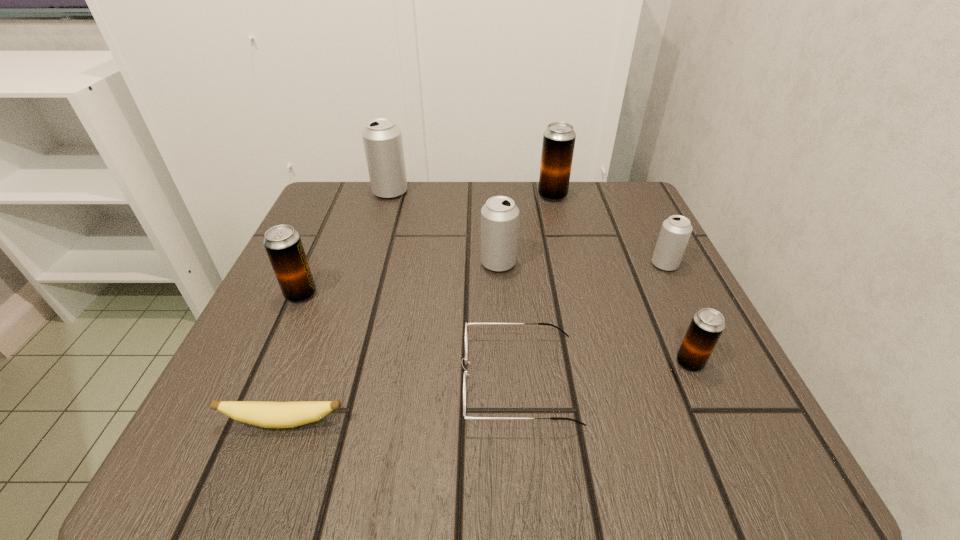
I want to click on the rightmost black beer can, so click(707, 325).

Find the location of a particular element. This screenshot has height=540, width=960. black spectacles is located at coordinates (469, 324).

The width and height of the screenshot is (960, 540). In order to click on the seventh tallest object in this screenshot , I will do (x=469, y=324).

I want to click on the shortest object, so click(x=263, y=414).

Where is `yellow banana`? The height and width of the screenshot is (540, 960). yellow banana is located at coordinates (263, 414).

Locate an element on the screen. The width and height of the screenshot is (960, 540). free space located 0.150m on the front of the farthest white beer can is located at coordinates (375, 240).

Locate an element on the screen. blank area located 0.130m on the left of the biggest black beer can is located at coordinates (x=482, y=195).

Identify the location of free region located 0.220m on the front of the fourth beer can from right to left. The width and height of the screenshot is (960, 540). (504, 371).

Locate an element on the screen. The image size is (960, 540). free location located 0.320m on the back of the second nearest beer can is located at coordinates (346, 193).

I want to click on vacant space positioned 0.190m on the left of the rightmost white beer can, so click(551, 264).